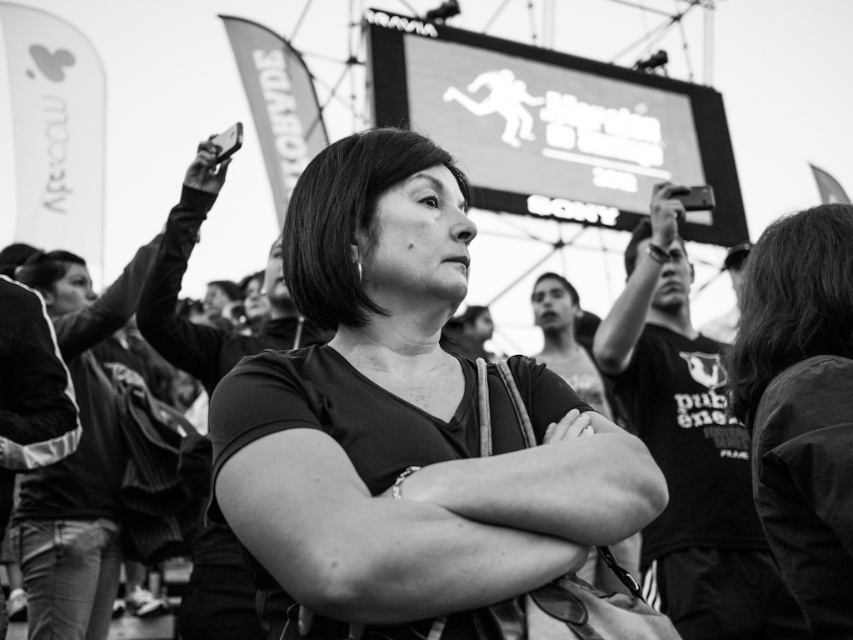
Who is shorter, smooth black jacket at center or metallic silver phone at upper left?

metallic silver phone at upper left is shorter.

From the picture: Which is more to the left, smooth black jacket at center or metallic silver phone at upper left?

Positioned to the left is metallic silver phone at upper left.

Where is `smooth black jacket at center`? The height and width of the screenshot is (640, 853). smooth black jacket at center is located at coordinates (801, 404).

Between metallic silver phone at upper left and metallic silver camera at upper center, which one is positioned lower?

metallic silver camera at upper center

Is point (224, 152) positioned behind point (680, 188)?

No.

Is point (199, 144) positioned after point (654, 220)?

No, (199, 144) is in front of (654, 220).

This screenshot has width=853, height=640. Identify the location of metallic silver phone at upper left. (212, 161).

Is smooth black shirt at center below metallic silver phone at upper left?

Yes, smooth black shirt at center is below metallic silver phone at upper left.

Which is behind, point (407, 580) or point (207, 157)?

The point (207, 157) is behind.

Identify the location of smooth black shirt at center. This screenshot has height=640, width=853. (415, 435).

Identify the location of smooth black shirt at center. (415, 435).